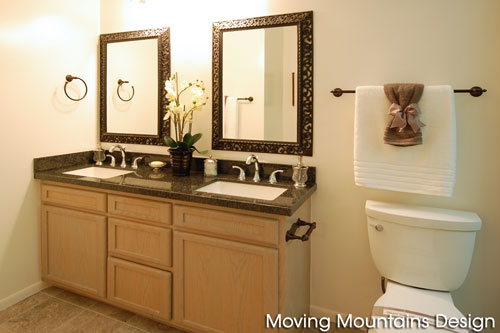
Locate an element on the screen. hand towel is located at coordinates (403, 87).